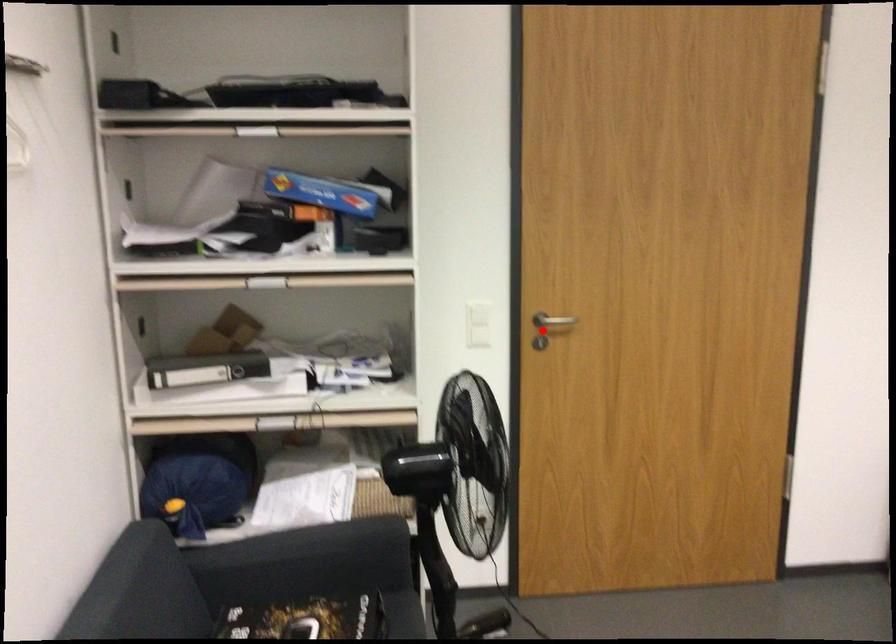
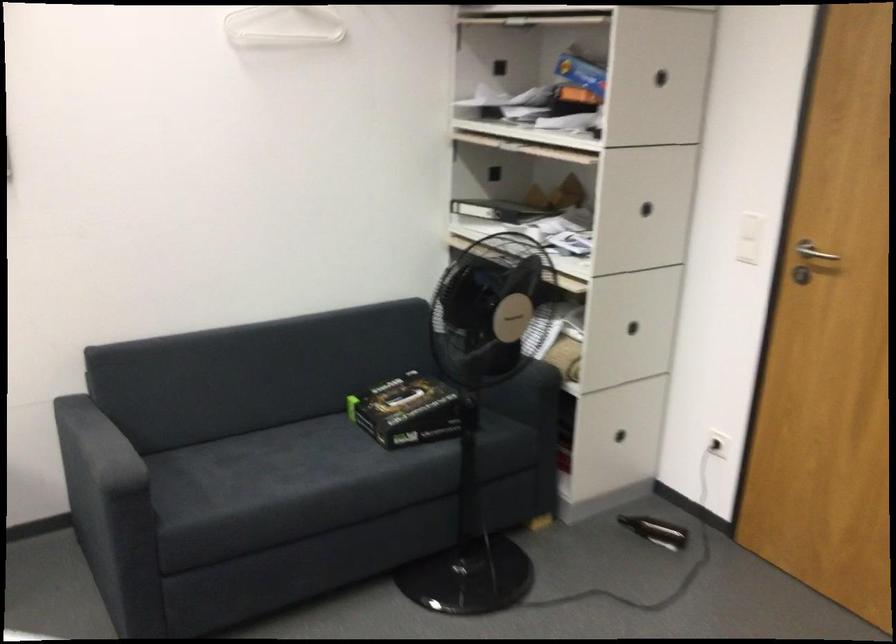
The point at the highlighted location is marked in the first image. Where is the corresponding point in the second image?

(813, 252)